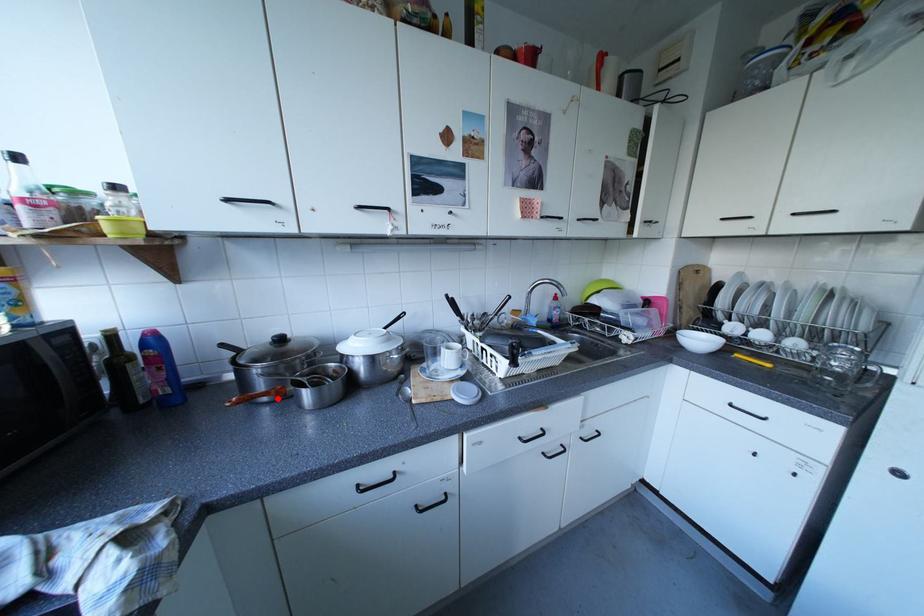
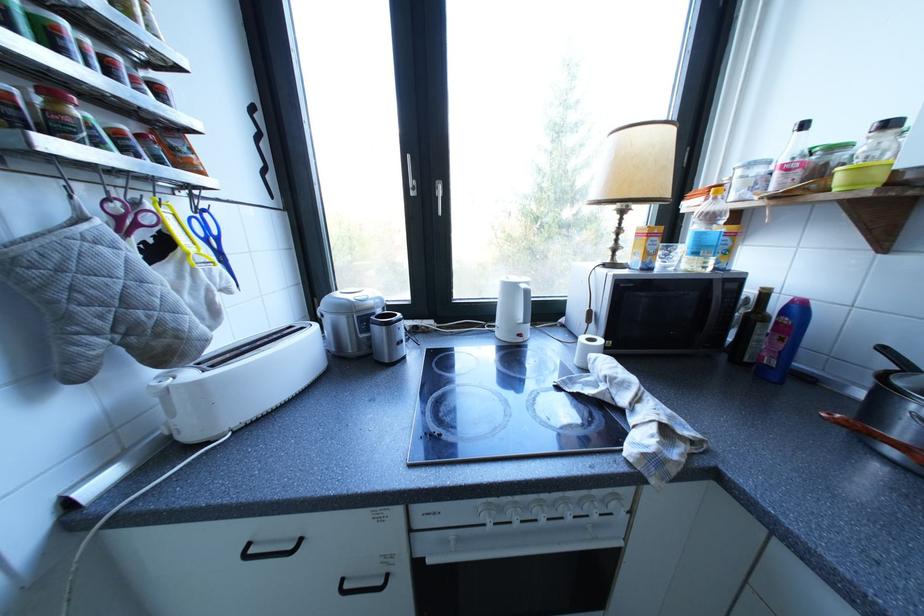
In the second image, find the point that corresponds to the highlighted location in the first image.

(907, 454)